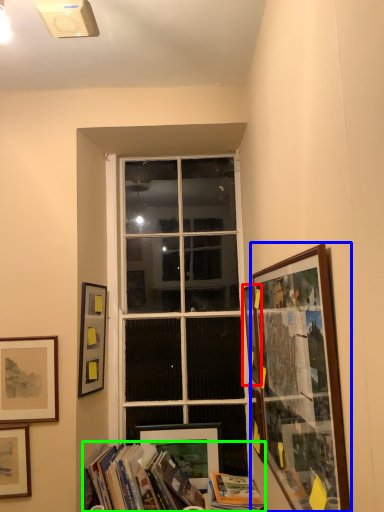
Question: Which is farther away from picture frame (highlighted by a red box)? picture frame (highlighted by a blue box) or book (highlighted by a green box)?

Choices:
 (A) picture frame
 (B) book

Answer: (B)